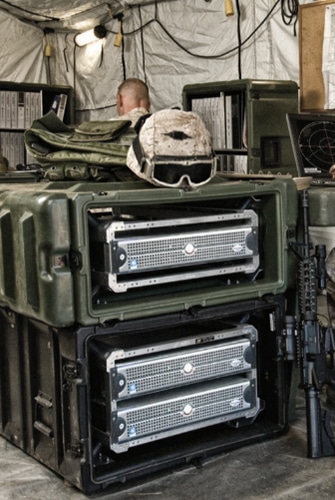
I want to click on lots of books, so click(213, 113).